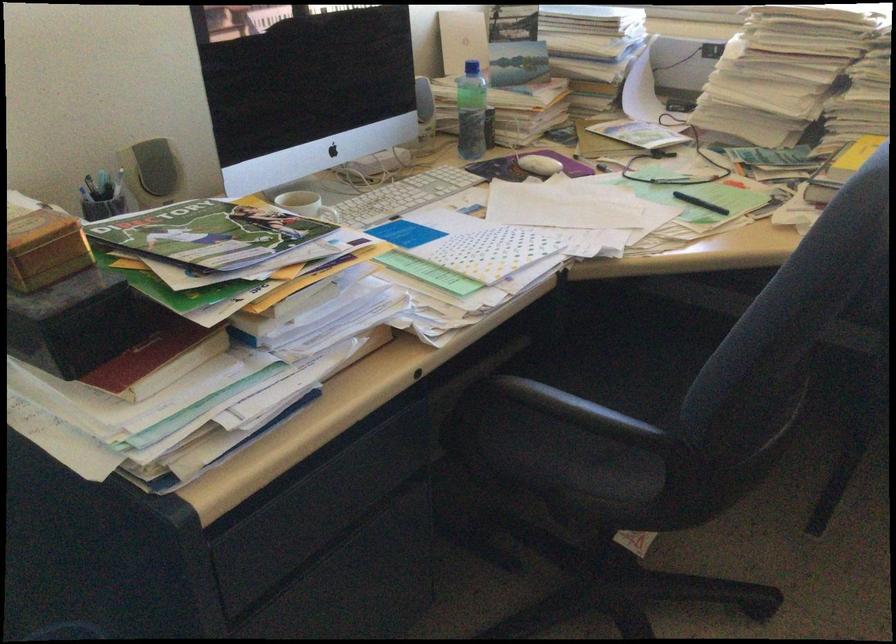
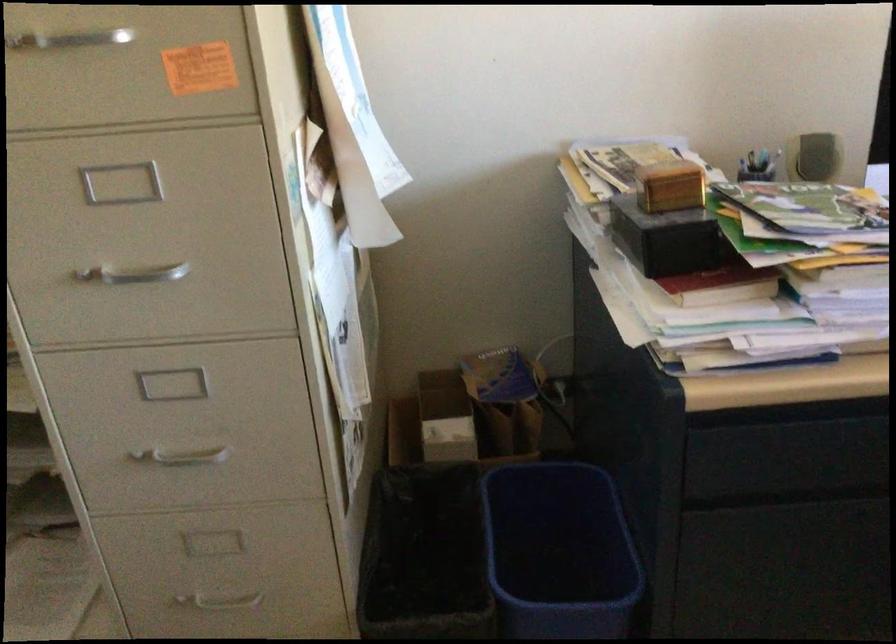
Question: How did the camera likely rotate?

Choices:
 (A) Left
 (B) Right
 (C) Up
 (D) Down

Answer: (A)